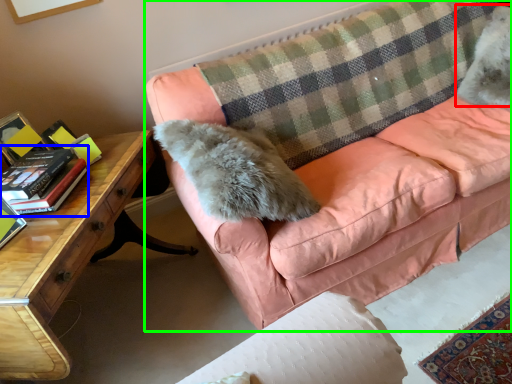
Question: Estimate the real-world distances between objects in this image. Which object is closer to animal (highlighted by a red box), paperback book (highlighted by a blue box) or studio couch (highlighted by a green box)?

Choices:
 (A) paperback book
 (B) studio couch

Answer: (B)